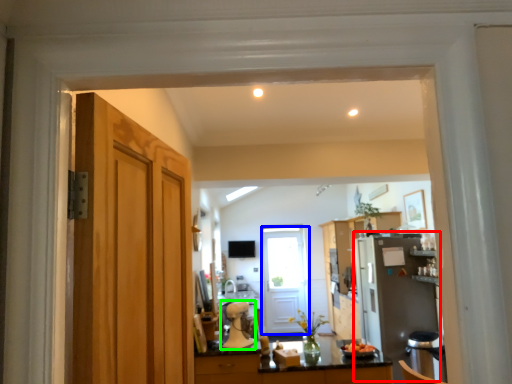
Question: Estimate the real-world distances between objects in this image. Which object is farther from appliance (highlighted by a red box), door (highlighted by a blue box) or appliance (highlighted by a green box)?

Choices:
 (A) door
 (B) appliance

Answer: (B)